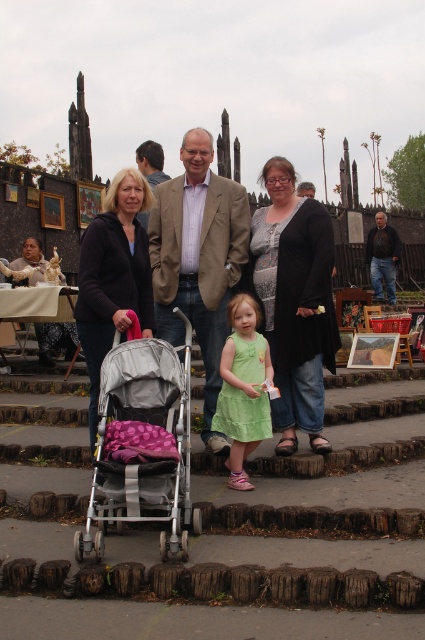
Question: Is matte black jacket at left to the right of green cotton dress at center from the viewer's perspective?

Choices:
 (A) no
 (B) yes

Answer: (A)

Question: Based on their relative distances, which object is nearer to the matte gray stroller at center?

Choices:
 (A) matte black jacket at left
 (B) brown leather jacket at center
 (C) black textured coat at center
 (D) smooth beige coat at center

Answer: (C)

Question: Which object is farther from the camera taking this photo?

Choices:
 (A) brown leather jacket at center
 (B) silver metallic stroller at center
 (C) beige textured blazer at center
 (D) smooth beige coat at center

Answer: (A)

Question: Does silver metallic stroller at center have a lesser width compared to light brown leather jacket at center?

Choices:
 (A) yes
 (B) no

Answer: (B)

Question: Considering the real-world distances, which object is closest to the black textured coat at center?

Choices:
 (A) light brown leather jacket at center
 (B) beige textured blazer at center
 (C) silver metallic stroller at center
 (D) green cotton dress at center

Answer: (B)

Question: Is silver metallic stroller at center to the left of beige textured blazer at center from the viewer's perspective?

Choices:
 (A) no
 (B) yes

Answer: (B)